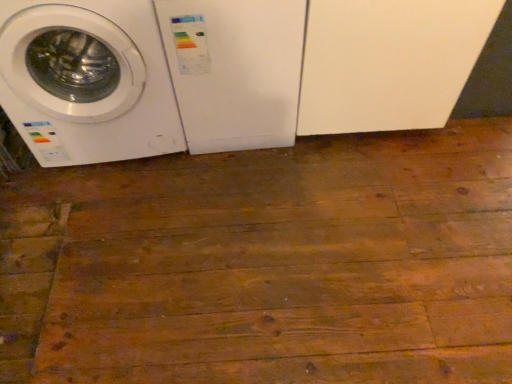
Describe the element at coordinates (87, 81) in the screenshot. This screenshot has width=512, height=384. I see `white glossy washing machine at left, which ranks as the 1th washing machine in left-to-right order` at that location.

What is the approximate height of white glossy washing machine at left, positioned as the second washing machine in right-to-left order?

The height of white glossy washing machine at left, positioned as the second washing machine in right-to-left order, is 28.04 inches.

Find the location of a particular element. white glossy washing machine at left, which ranks as the 1th washing machine in left-to-right order is located at coordinates (87, 81).

How much space does white glossy washing machine at left, which ranks as the 1th washing machine in left-to-right order, occupy horizontally?

white glossy washing machine at left, which ranks as the 1th washing machine in left-to-right order, is 25.73 inches wide.

In order to face white glossy washing machine at left, positioned as the second washing machine in right-to-left order, should I rotate leftwards or rightwards?

It's best to rotate left around 20.507 degrees.

The image size is (512, 384). What do you see at coordinates (234, 70) in the screenshot?
I see `white plastic washing machine at center, which is the first washing machine from right to left` at bounding box center [234, 70].

How much space does white plastic washing machine at center, the 2th washing machine viewed from the left, occupy horizontally?

It is 63.40 centimeters.

Locate an element on the screen. white plastic washing machine at center, which is the first washing machine from right to left is located at coordinates tap(234, 70).

You are a GUI agent. You are given a task and a screenshot of the screen. Output one action in this format:
    pyautogui.click(x=<x>, y=<y>)
    Task: Click on the white glossy washing machine at left, which ranks as the 1th washing machine in left-to-right order
    The height and width of the screenshot is (384, 512).
    Given the screenshot: What is the action you would take?
    pyautogui.click(x=87, y=81)

Is white plastic washing machine at center, which is the first washing machine from right to left, at the right side of white glossy washing machine at left, which ranks as the 1th washing machine in left-to-right order?

Indeed, white plastic washing machine at center, which is the first washing machine from right to left, is positioned on the right side of white glossy washing machine at left, which ranks as the 1th washing machine in left-to-right order.

Which object is further away from the camera taking this photo, white plastic washing machine at center, the 2th washing machine viewed from the left, or white glossy washing machine at left, which ranks as the 1th washing machine in left-to-right order?

white plastic washing machine at center, the 2th washing machine viewed from the left.

Which point is more forward, (182, 107) or (155, 25)?

Point (155, 25)

From the image's perspective, is white plastic washing machine at center, the 2th washing machine viewed from the left, positioned above or below white glossy washing machine at left, which ranks as the 1th washing machine in left-to-right order?

From the image's perspective, white plastic washing machine at center, the 2th washing machine viewed from the left, appears above white glossy washing machine at left, which ranks as the 1th washing machine in left-to-right order.

From a real-world perspective, who is located higher, white plastic washing machine at center, the 2th washing machine viewed from the left, or white glossy washing machine at left, which ranks as the 1th washing machine in left-to-right order?

white glossy washing machine at left, which ranks as the 1th washing machine in left-to-right order, is physically above.

Considering the sizes of objects white plastic washing machine at center, which is the first washing machine from right to left, and white glossy washing machine at left, positioned as the second washing machine in right-to-left order, in the image provided, who is thinner, white plastic washing machine at center, which is the first washing machine from right to left, or white glossy washing machine at left, positioned as the second washing machine in right-to-left order,?

white plastic washing machine at center, which is the first washing machine from right to left, is thinner.

Considering the sizes of white plastic washing machine at center, the 2th washing machine viewed from the left, and white glossy washing machine at left, positioned as the second washing machine in right-to-left order, in the image, is white plastic washing machine at center, the 2th washing machine viewed from the left, taller or shorter than white glossy washing machine at left, positioned as the second washing machine in right-to-left order,?

Considering their sizes, white plastic washing machine at center, the 2th washing machine viewed from the left, has less height than white glossy washing machine at left, positioned as the second washing machine in right-to-left order.

Looking at this image, which of these two, white plastic washing machine at center, the 2th washing machine viewed from the left, or white glossy washing machine at left, positioned as the second washing machine in right-to-left order, is bigger?

white glossy washing machine at left, positioned as the second washing machine in right-to-left order.

Can white glossy washing machine at left, positioned as the second washing machine in right-to-left order, be found inside white plastic washing machine at center, the 2th washing machine viewed from the left?

No, white glossy washing machine at left, positioned as the second washing machine in right-to-left order, is not inside white plastic washing machine at center, the 2th washing machine viewed from the left.

Are white plastic washing machine at center, which is the first washing machine from right to left, and white glossy washing machine at left, which ranks as the 1th washing machine in left-to-right order, far apart?

They are positioned close to each other.

Consider the image. Is white plastic washing machine at center, which is the first washing machine from right to left, aimed at white glossy washing machine at left, which ranks as the 1th washing machine in left-to-right order?

No, white plastic washing machine at center, which is the first washing machine from right to left, is not facing towards white glossy washing machine at left, which ranks as the 1th washing machine in left-to-right order.

I want to click on washing machine above the white glossy washing machine at left, which ranks as the 1th washing machine in left-to-right order (from the image's perspective), so click(x=234, y=70).

Does white glossy washing machine at left, which ranks as the 1th washing machine in left-to-right order, appear on the left side of white plastic washing machine at center, which is the first washing machine from right to left?

Yes.

Is white glossy washing machine at left, positioned as the second washing machine in right-to-left order, positioned behind white plastic washing machine at center, which is the first washing machine from right to left?

No, white glossy washing machine at left, positioned as the second washing machine in right-to-left order, is closer to the camera.

Does point (106, 49) come behind point (239, 52)?

Yes, it is.

From the image's perspective, is white glossy washing machine at left, positioned as the second washing machine in right-to-left order, over white plastic washing machine at center, the 2th washing machine viewed from the left?

No, from the image's perspective, white glossy washing machine at left, positioned as the second washing machine in right-to-left order, is not on top of white plastic washing machine at center, the 2th washing machine viewed from the left.

From a real-world perspective, which object stands above the other?

white glossy washing machine at left, positioned as the second washing machine in right-to-left order, from a real-world perspective.

Is white glossy washing machine at left, positioned as the second washing machine in right-to-left order, wider or thinner than white plastic washing machine at center, which is the first washing machine from right to left?

white glossy washing machine at left, positioned as the second washing machine in right-to-left order, is wider than white plastic washing machine at center, which is the first washing machine from right to left.

Is white glossy washing machine at left, which ranks as the 1th washing machine in left-to-right order, taller than white plastic washing machine at center, the 2th washing machine viewed from the left?

Indeed, white glossy washing machine at left, which ranks as the 1th washing machine in left-to-right order, has a greater height compared to white plastic washing machine at center, the 2th washing machine viewed from the left.

Can you confirm if white glossy washing machine at left, which ranks as the 1th washing machine in left-to-right order, is smaller than white plastic washing machine at center, the 2th washing machine viewed from the left?

No.

Choose the correct answer: Is white glossy washing machine at left, which ranks as the 1th washing machine in left-to-right order, inside white plastic washing machine at center, the 2th washing machine viewed from the left, or outside it?

white glossy washing machine at left, which ranks as the 1th washing machine in left-to-right order, is outside white plastic washing machine at center, the 2th washing machine viewed from the left.

Does white glossy washing machine at left, which ranks as the 1th washing machine in left-to-right order, touch white plastic washing machine at center, which is the first washing machine from right to left?

No, white glossy washing machine at left, which ranks as the 1th washing machine in left-to-right order, is not with white plastic washing machine at center, which is the first washing machine from right to left.

Could you tell me if white glossy washing machine at left, which ranks as the 1th washing machine in left-to-right order, is turned towards white plastic washing machine at center, which is the first washing machine from right to left?

No, white glossy washing machine at left, which ranks as the 1th washing machine in left-to-right order, is not facing towards white plastic washing machine at center, which is the first washing machine from right to left.

The height and width of the screenshot is (384, 512). Identify the location of washing machine on the right of white glossy washing machine at left, positioned as the second washing machine in right-to-left order. (234, 70).

Find the location of a particular element. Image resolution: width=512 pixels, height=384 pixels. washing machine that appears on the right of white glossy washing machine at left, which ranks as the 1th washing machine in left-to-right order is located at coordinates (234, 70).

Identify the location of washing machine above the white glossy washing machine at left, which ranks as the 1th washing machine in left-to-right order (from the image's perspective). (234, 70).